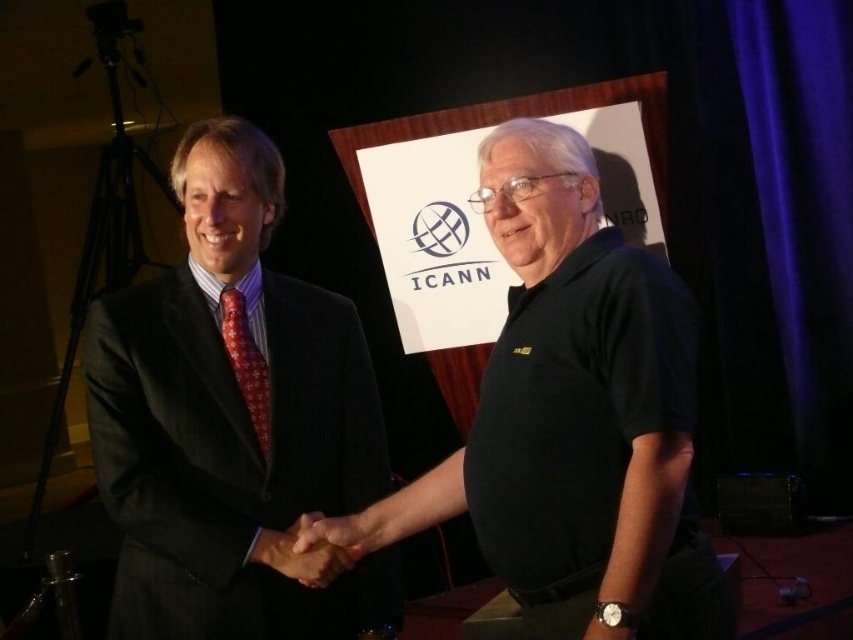
Question: Considering the real-world distances, which object is closest to the red floral tie at center?

Choices:
 (A) matte black hand at center
 (B) black cotton polo shirt at center
 (C) smooth skin handshake at center
 (D) matte black suit at left

Answer: (D)

Question: Considering the relative positions of matte black suit at left and smooth skin handshake at center in the image provided, where is matte black suit at left located with respect to smooth skin handshake at center?

Choices:
 (A) left
 (B) right

Answer: (A)

Question: Can you confirm if smooth skin handshake at center is positioned to the right of matte black hand at center?

Choices:
 (A) no
 (B) yes

Answer: (A)

Question: Considering the real-world distances, which object is farthest from the red floral tie at center?

Choices:
 (A) smooth skin handshake at center
 (B) matte black suit at left

Answer: (A)

Question: Can you confirm if matte black suit at left is thinner than black cotton polo shirt at center?

Choices:
 (A) no
 (B) yes

Answer: (A)

Question: Which of the following is the farthest from the observer?

Choices:
 (A) black cotton polo shirt at center
 (B) smooth skin handshake at center

Answer: (B)